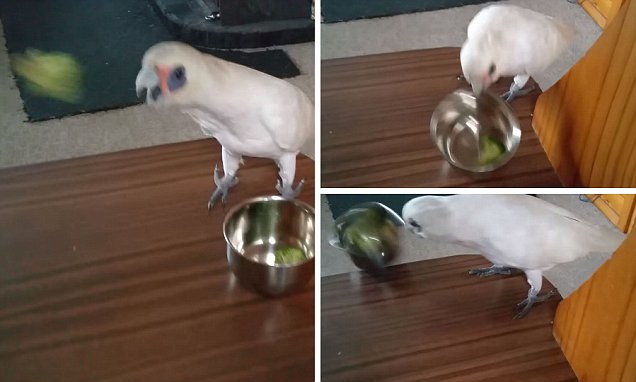
This screenshot has width=636, height=382. I want to click on table, so click(x=144, y=277).